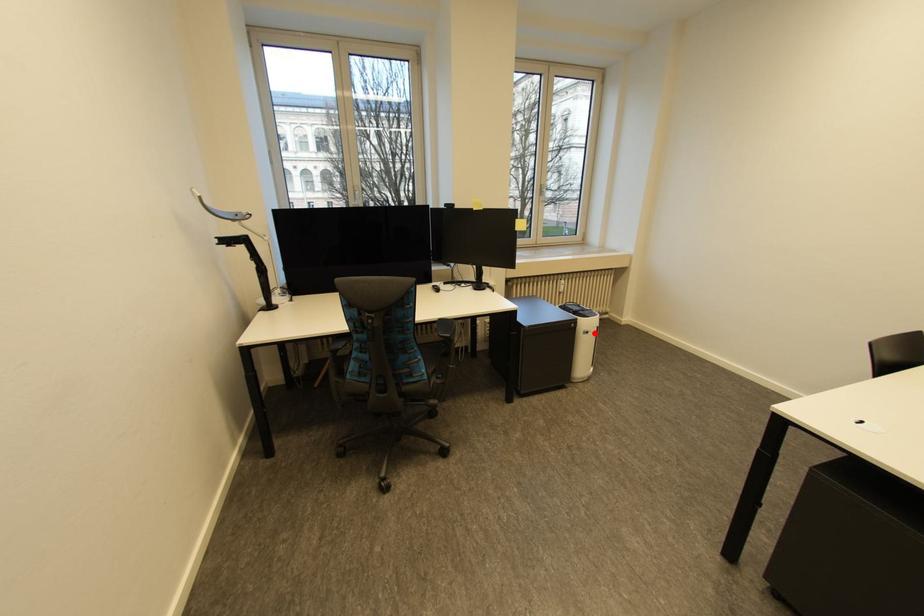
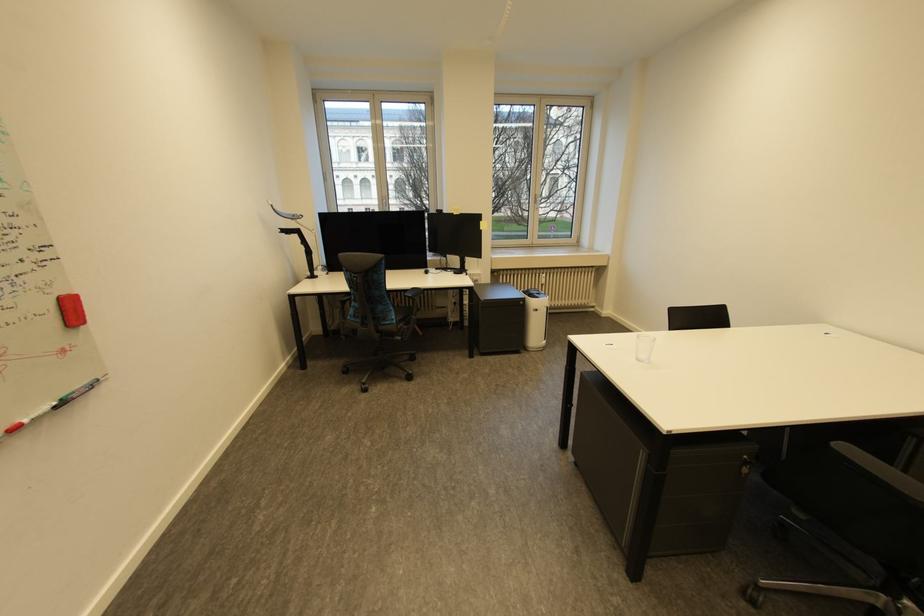
Question: I am providing you with two images of the same scene from different viewpoints. A red point is shown in image1. For the corresponding object point in image2, is it positioned nearer or farther from the camera?

Choices:
 (A) Nearer
 (B) Farther

Answer: (A)